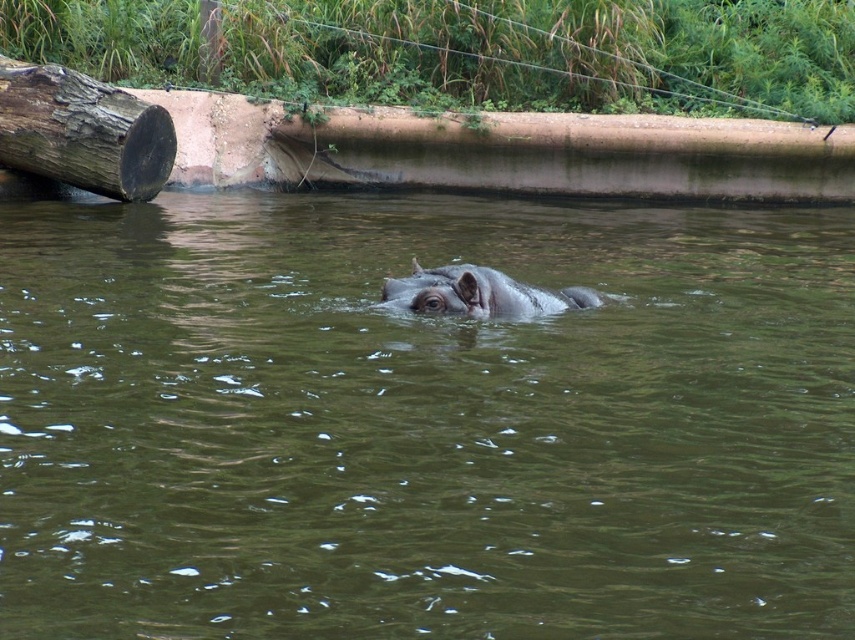
Question: Which point is closer to the camera?

Choices:
 (A) coord(786,310)
 (B) coord(103,124)
 (C) coord(509,310)

Answer: (C)

Question: Among these points, which one is nearest to the camera?

Choices:
 (A) (1, 160)
 (B) (118, 372)
 (C) (382, 301)

Answer: (B)

Question: Is dark brown rough log at left positioned before gray matte hippo at center?

Choices:
 (A) yes
 (B) no

Answer: (B)

Question: Is brown murky water at center bigger than gray matte hippo at center?

Choices:
 (A) no
 (B) yes

Answer: (B)

Question: Can you confirm if dark brown rough log at left is wider than gray matte hippo at center?

Choices:
 (A) yes
 (B) no

Answer: (A)

Question: Which of the following is the farthest from the observer?

Choices:
 (A) (161, 124)
 (B) (528, 624)

Answer: (A)